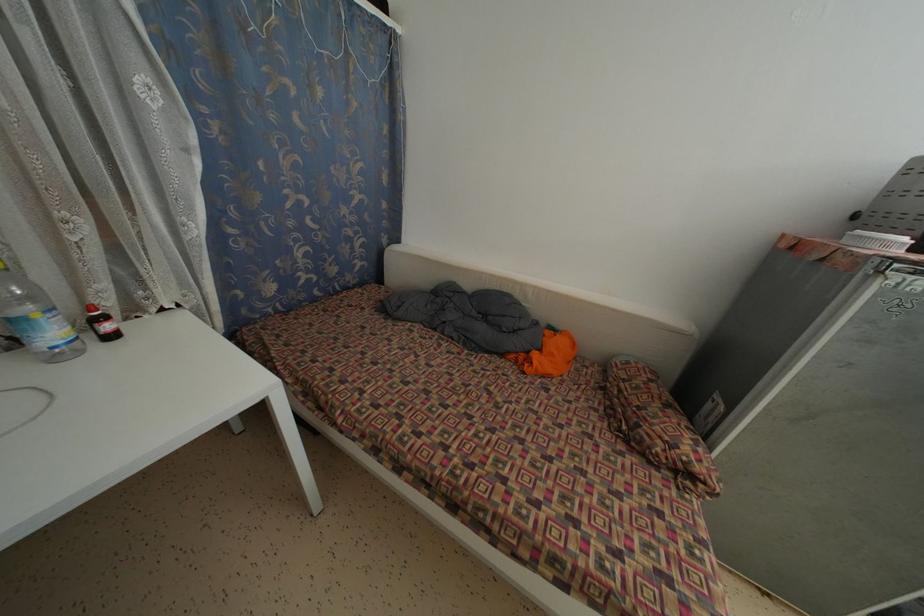
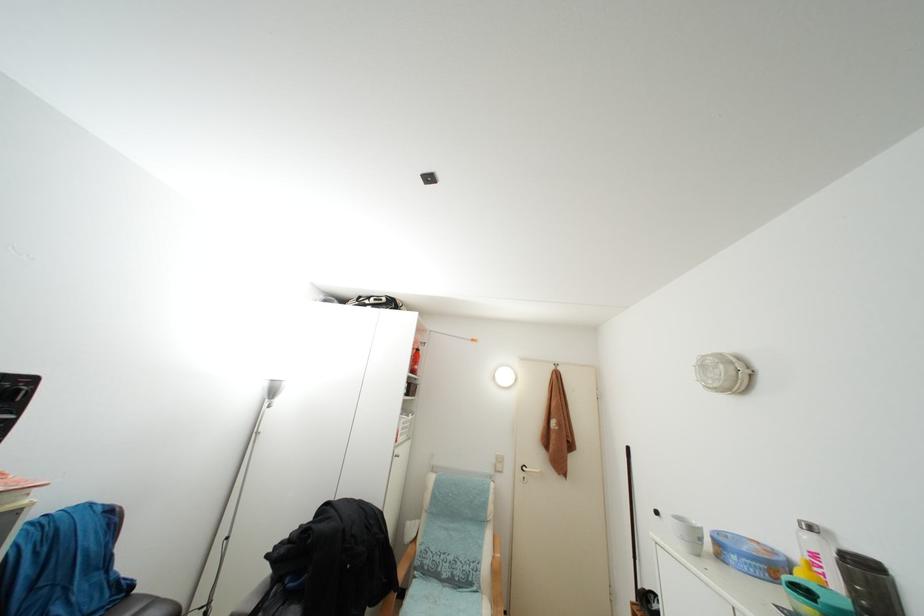
Question: Based on the continuous images, in which direction is the camera rotating? Reply with the corresponding letter.

Choices:
 (A) Left
 (B) Right
 (C) Up
 (D) Down

Answer: (B)